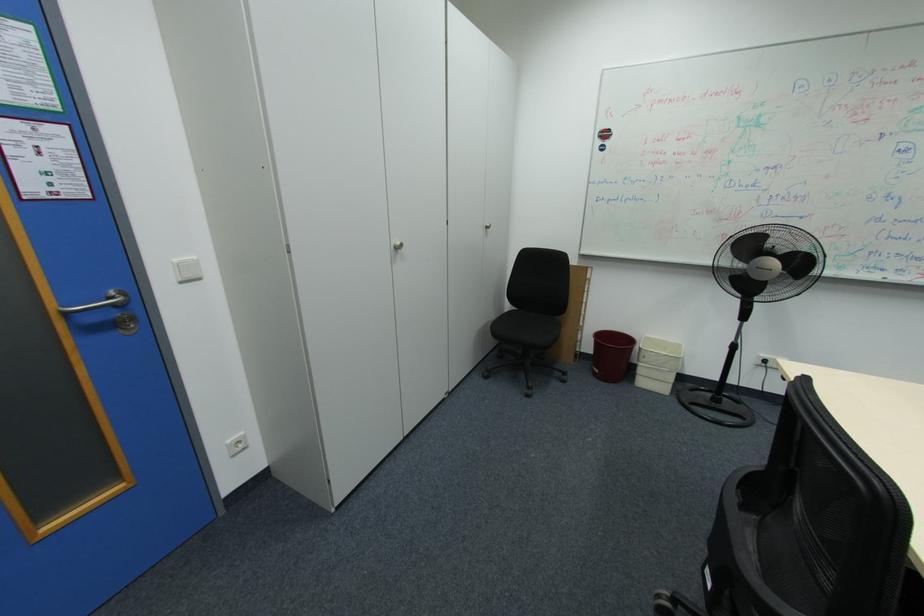
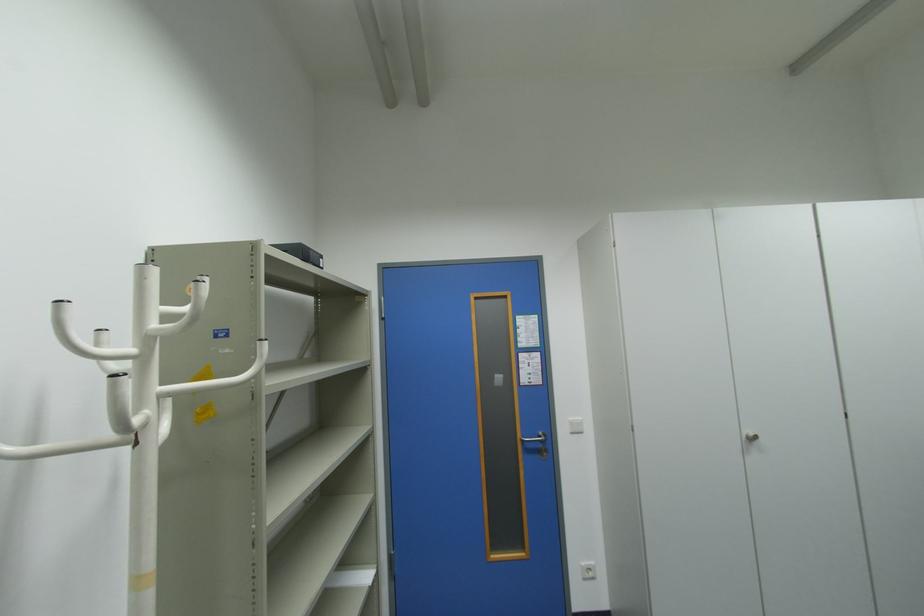
Question: The camera is either moving clockwise (left) or counter-clockwise (right) around the object. The first image is from the beginning of the video and the second image is from the end. Is the camera moving left or right when shooting the video?

Choices:
 (A) Left
 (B) Right

Answer: (B)